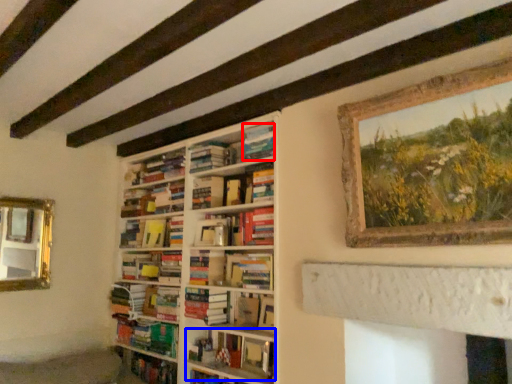
Question: Which object appears farthest to the camera in this image, paperback book (highlighted by a red box) or book (highlighted by a blue box)?

Choices:
 (A) paperback book
 (B) book

Answer: (A)